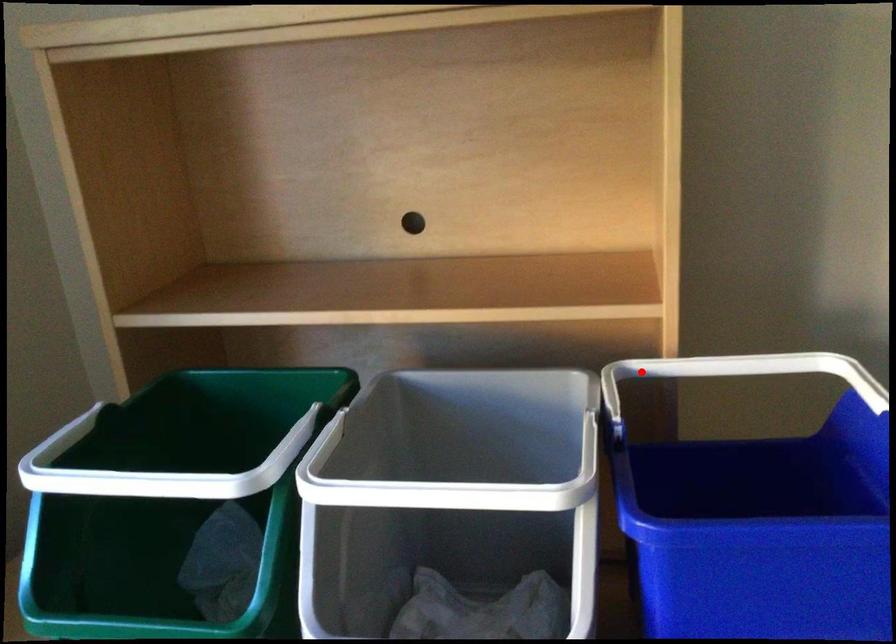
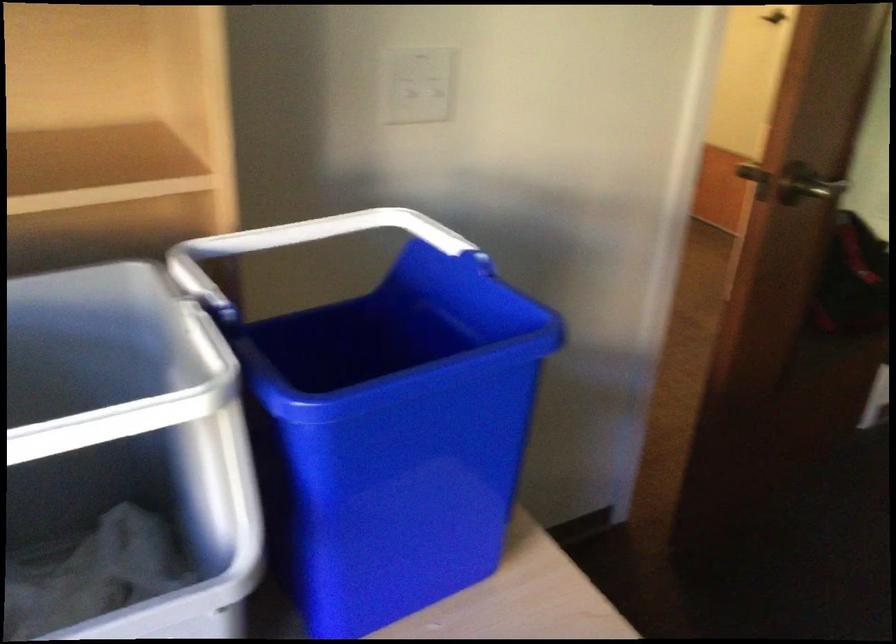
Question: I am providing you with two images of the same scene from different viewpoints. In image1, a red point is highlighted. Considering the same 3D point in image2, which of the following is correct?

Choices:
 (A) It is closer
 (B) It is farther

Answer: (A)